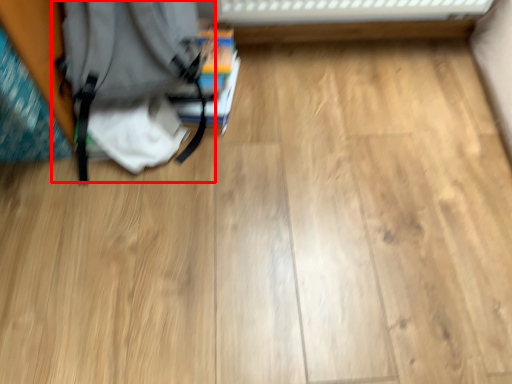
Question: From the image's perspective, considering the relative positions of backpack (annotated by the red box) and book in the image provided, where is backpack (annotated by the red box) located with respect to the staircase?

Choices:
 (A) below
 (B) above

Answer: (A)